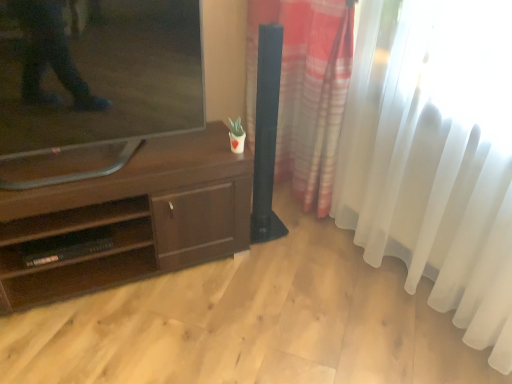
Locate an element on the screen. The image size is (512, 384). empty space that is ontop of black plastic shelf at lower left is located at coordinates (69, 241).